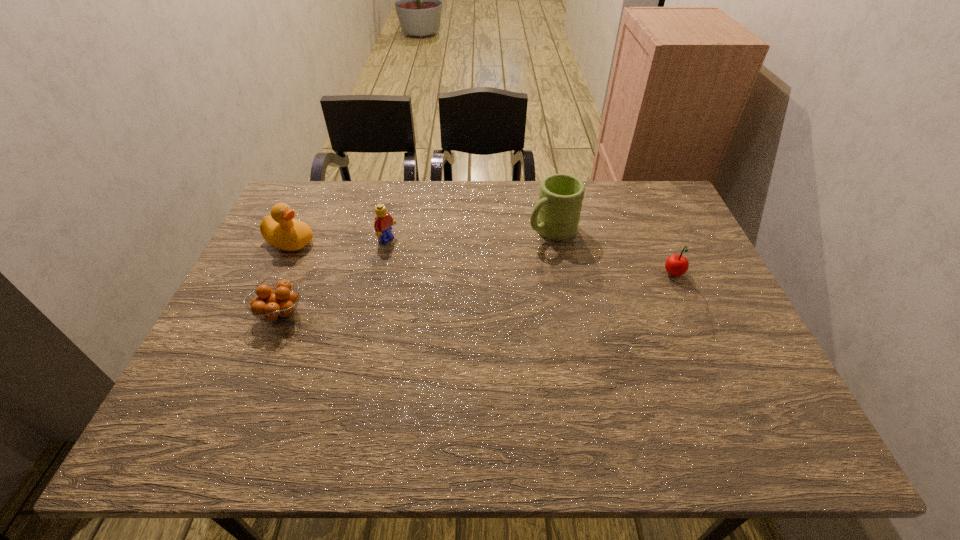
You are a GUI agent. You are given a task and a screenshot of the screen. Output one action in this format:
    pyautogui.click(x=<x>, y=<y>)
    Task: Click on the duck that is positioned at the left edge
    Image resolution: width=960 pixels, height=540 pixels.
    Given the screenshot: What is the action you would take?
    pyautogui.click(x=280, y=229)

Where is `object that is at the right edge`? Image resolution: width=960 pixels, height=540 pixels. object that is at the right edge is located at coordinates (676, 265).

This screenshot has width=960, height=540. I want to click on vacant space at the far edge of the desktop, so click(x=359, y=209).

Where is `free region at the near edge of the desktop`? This screenshot has height=540, width=960. free region at the near edge of the desktop is located at coordinates (445, 386).

Locate an element on the screen. The height and width of the screenshot is (540, 960). vacant space at the left edge of the desktop is located at coordinates 314,259.

Where is `free space at the right edge of the desktop`? Image resolution: width=960 pixels, height=540 pixels. free space at the right edge of the desktop is located at coordinates (696, 326).

At what (x,y) coordinates should I click in order to perform the action: click on vacant space at the far left corner of the desktop. Please return your answer as a coordinate pair (x, y). This screenshot has height=540, width=960. Looking at the image, I should click on (313, 205).

In the image, there is a desktop. Where is `vacant space at the near left corner`? The width and height of the screenshot is (960, 540). vacant space at the near left corner is located at coordinates (241, 395).

Find the location of `vacant space at the far right corner of the desktop`. vacant space at the far right corner of the desktop is located at coordinates (652, 190).

I want to click on free area in between the fourth object from left to right and the cherry, so click(x=612, y=253).